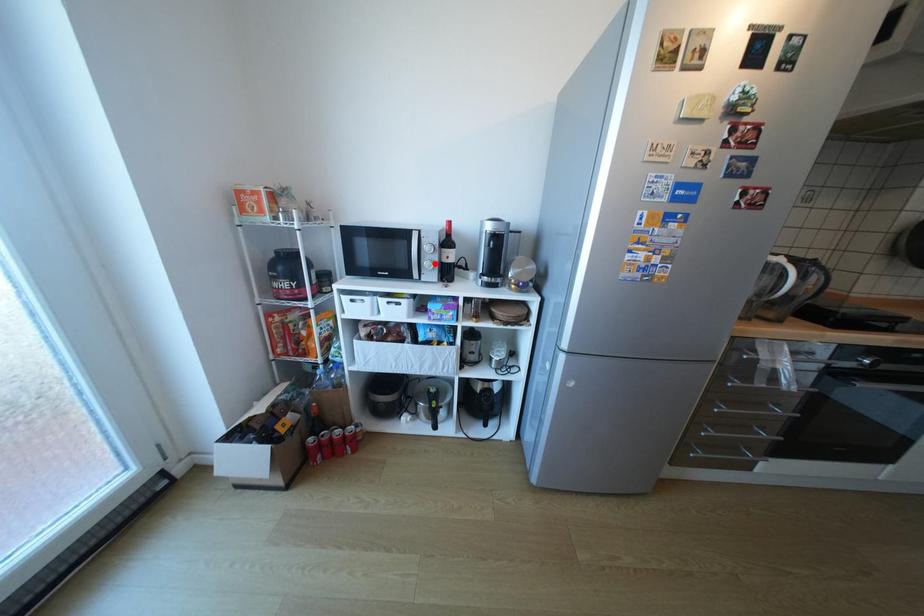
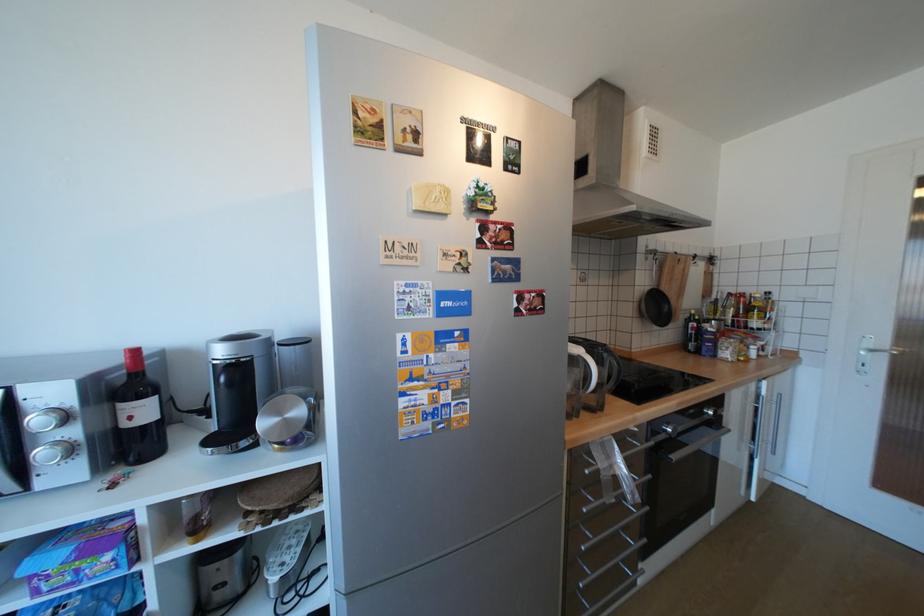
Where in the second image is the point corresponding to the highlighted location from the first image?

(52, 453)